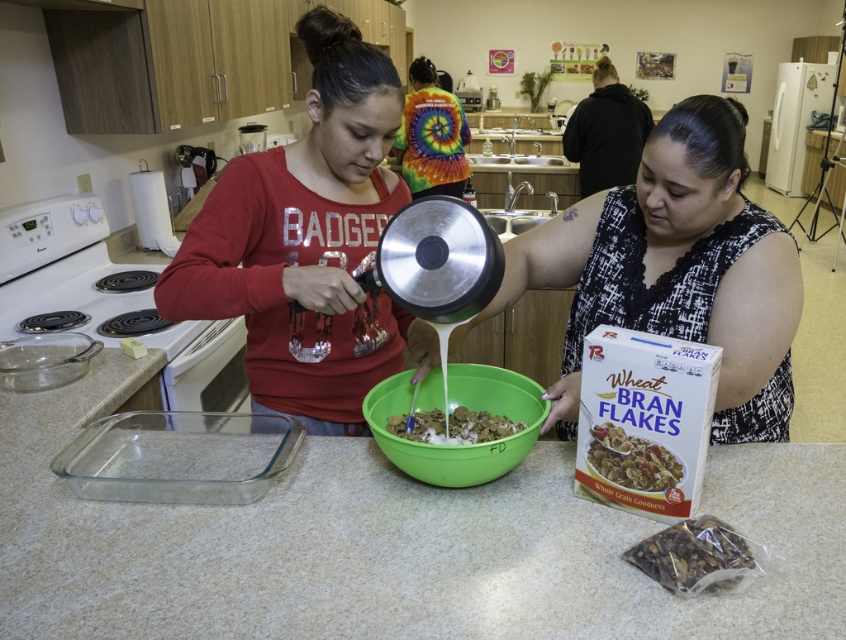
Is smooth white countertop at center below white cardboard wheat bran flakes at lower right?

Correct, smooth white countertop at center is located below white cardboard wheat bran flakes at lower right.

Find the location of a particular element. smooth white countertop at center is located at coordinates (389, 545).

Identify the location of smooth white countertop at center. (389, 545).

Who is higher up, shiny metallic pot at center or matte brown cereal at center?

Positioned higher is shiny metallic pot at center.

Is shiny metallic pot at center smaller than matte brown cereal at center?

No, shiny metallic pot at center is not smaller than matte brown cereal at center.

Is point (316, 250) positioned in front of point (487, 422)?

No, it is behind (487, 422).

This screenshot has width=846, height=640. In order to click on shiny metallic pot at center in this screenshot , I will do `click(306, 241)`.

Does point (345, 470) come in front of point (695, 536)?

No.

Looking at this image, does smooth white countertop at center have a lesser height compared to translucent plastic bag of granola at center?

No, smooth white countertop at center is not shorter than translucent plastic bag of granola at center.

Measure the distance between point (x=83, y=611) and camera.

Point (x=83, y=611) and camera are 34.93 inches apart from each other.

This screenshot has height=640, width=846. Identify the location of smooth white countertop at center. (389, 545).